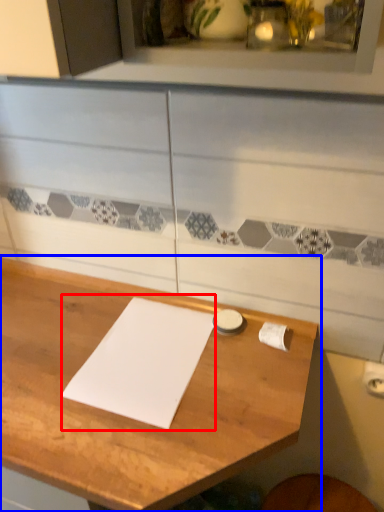
Question: Which object appears farthest to the camera in this image, journal (highlighted by a red box) or table (highlighted by a blue box)?

Choices:
 (A) journal
 (B) table

Answer: (A)